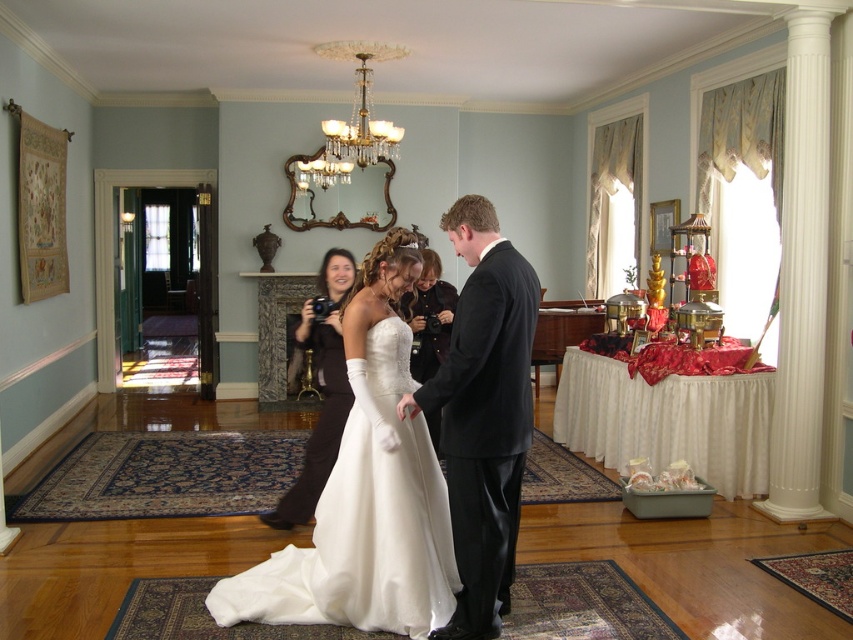
You are a photographer at the wedding. You want to take a photo of the shiny black suit at center without the matte black camera at center appearing in the background. Is it possible to do so?

The shiny black suit at center is in front of the matte black camera at center, so if you position yourself so that the suit blocks the camera from view, you can take the photo without the camera appearing in the background.

You are a photographer at the wedding and need to capture a photo of both the white satin dress at center and the shiny black suit at center. Which one is more to the left in the image?

The white satin dress at center is positioned on the left side of the shiny black suit at center, so it is more to the left in the image.

Where is the white satin dress at center located in the image?

The white satin dress at center is located at point (364, 520) in the image.